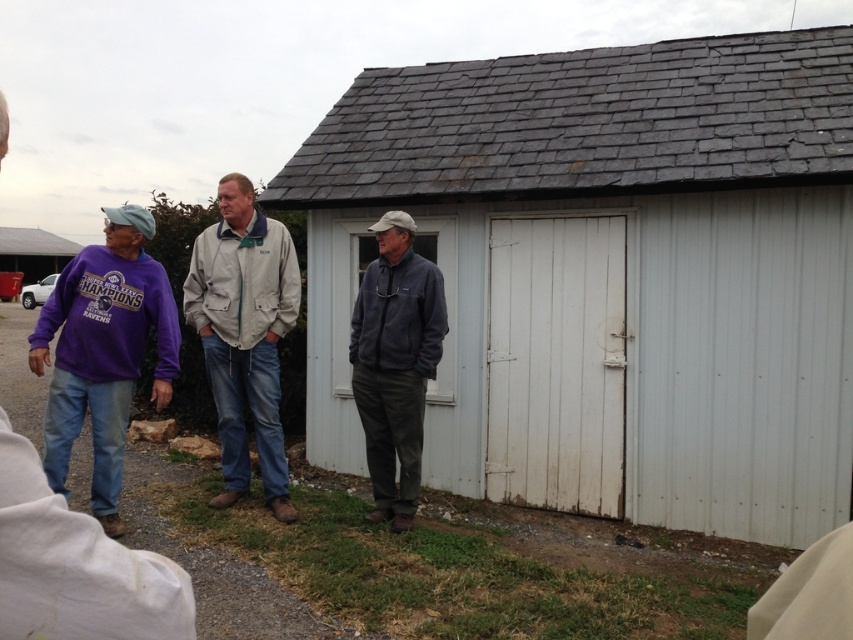
Is dark gray fleece jacket at center further to the viewer compared to brushed metal shed at upper left?

No, dark gray fleece jacket at center is in front of brushed metal shed at upper left.

Which is below, dark gray fleece jacket at center or brushed metal shed at upper left?

dark gray fleece jacket at center

Measure the distance between point (407, 365) and camera.

The distance of point (407, 365) from camera is 5.15 meters.

Identify the location of dark gray fleece jacket at center. The image size is (853, 640). (395, 362).

Is white wood shed at center to the left of purple fleece jacket at left from the viewer's perspective?

In fact, white wood shed at center is to the right of purple fleece jacket at left.

Who is more forward, (795, 83) or (109, 304)?

Point (109, 304)

Is point (616, 312) farther from camera compared to point (281, 307)?

Yes, point (616, 312) is farther from viewer.

Find the location of a particular element. Image resolution: width=853 pixels, height=640 pixels. white wood shed at center is located at coordinates (608, 275).

Between purple fleece jacket at left and dark gray fleece jacket at center, which one is positioned higher?

purple fleece jacket at left is above.

Does point (285, 282) come farther from viewer compared to point (440, 288)?

That is True.

Find the location of a particular element. The image size is (853, 640). purple fleece jacket at left is located at coordinates (103, 330).